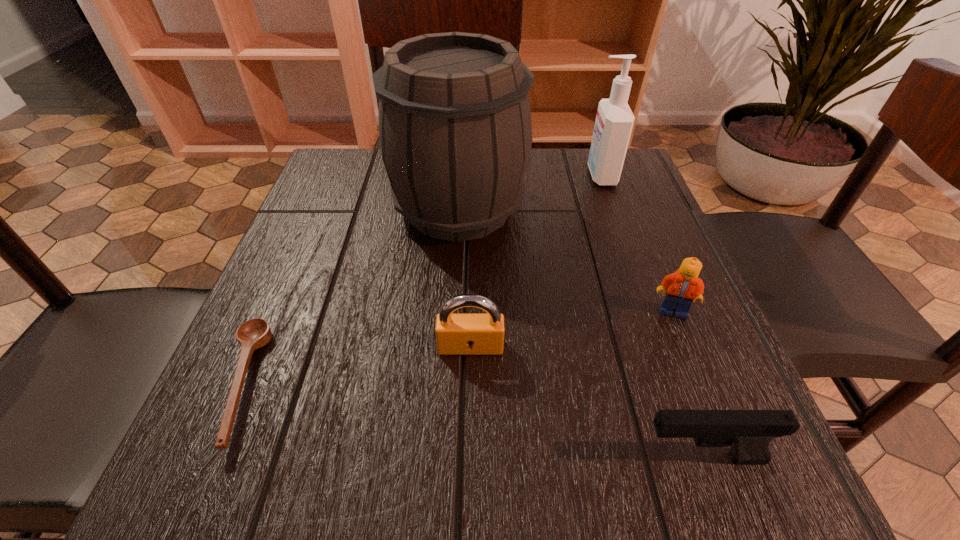
At what (x,y) coordinates should I click in order to perform the action: click on free spot between the Lego and the fifth shortest object. Please return your answer as a coordinate pair (x, y). This screenshot has width=960, height=540. Looking at the image, I should click on (636, 243).

Image resolution: width=960 pixels, height=540 pixels. What are the coordinates of `free space between the pistol and the cleansing agent` in the screenshot? It's located at (651, 316).

Find the location of a particular element. This screenshot has height=540, width=960. unoccupied area between the pistol and the wine bucket is located at coordinates (580, 333).

Find the location of a particular element. The width and height of the screenshot is (960, 540). vacant region between the tallest object and the wooden spoon is located at coordinates (349, 296).

At what (x,y) coordinates should I click in order to perform the action: click on object that is the fourth closest to the tallest object. Please return your answer as a coordinate pair (x, y). The height and width of the screenshot is (540, 960). Looking at the image, I should click on (684, 286).

Locate an element on the screen. The image size is (960, 540). the closest object relative to the tallest object is located at coordinates (614, 121).

At what (x,y) coordinates should I click in order to perform the action: click on vacant space that satisfies the following two spatial constraints: 1. on the front label of the cleansing agent; 2. to unlock the padlock from the front. Please return your answer as a coordinate pair (x, y). The height and width of the screenshot is (540, 960). Looking at the image, I should click on (661, 347).